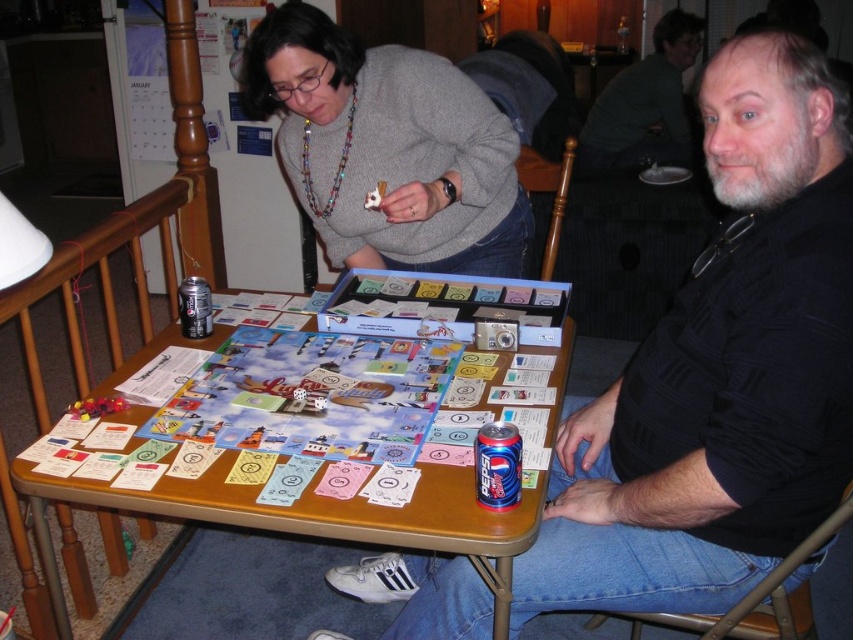
Question: Is black matte shirt at center further to the viewer compared to blue metallic can at lower center?

Choices:
 (A) no
 (B) yes

Answer: (A)

Question: Does gray sweater at upper center have a greater width compared to metallic silver can at center?

Choices:
 (A) yes
 (B) no

Answer: (A)

Question: Which object is positioned closest to the wooden table at center?

Choices:
 (A) dark gray shirt at upper right
 (B) metallic silver can at center
 (C) gray sweater at upper center
 (D) black matte shirt at center

Answer: (D)

Question: Is dark gray shirt at upper right below metallic silver can at center?

Choices:
 (A) no
 (B) yes

Answer: (A)

Question: Which object is farther from the camera taking this photo?

Choices:
 (A) wooden table at center
 (B) gray sweater at upper center

Answer: (B)

Question: Among these objects, which one is nearest to the camera?

Choices:
 (A) black matte shirt at center
 (B) metallic silver can at center
 (C) gray sweater at upper center
 (D) blue metallic can at lower center

Answer: (A)